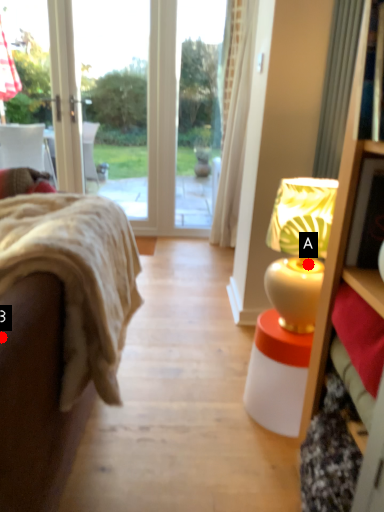
Question: Two points are circled on the image, labeled by A and B beside each circle. Among these points, which one is farthest from the camera?

Choices:
 (A) A is further
 (B) B is further

Answer: (A)